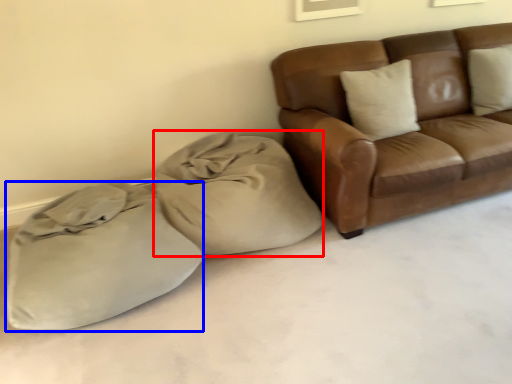
Question: Which point is closer to the camera, bean bag chair (highlighted by a red box) or sack (highlighted by a blue box)?

Choices:
 (A) bean bag chair
 (B) sack

Answer: (B)